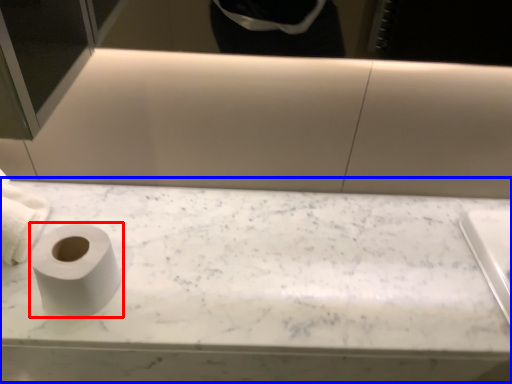
Question: Which of the following is the closest to the observer, toilet paper (highlighted by a red box) or counter top (highlighted by a blue box)?

Choices:
 (A) toilet paper
 (B) counter top

Answer: (A)